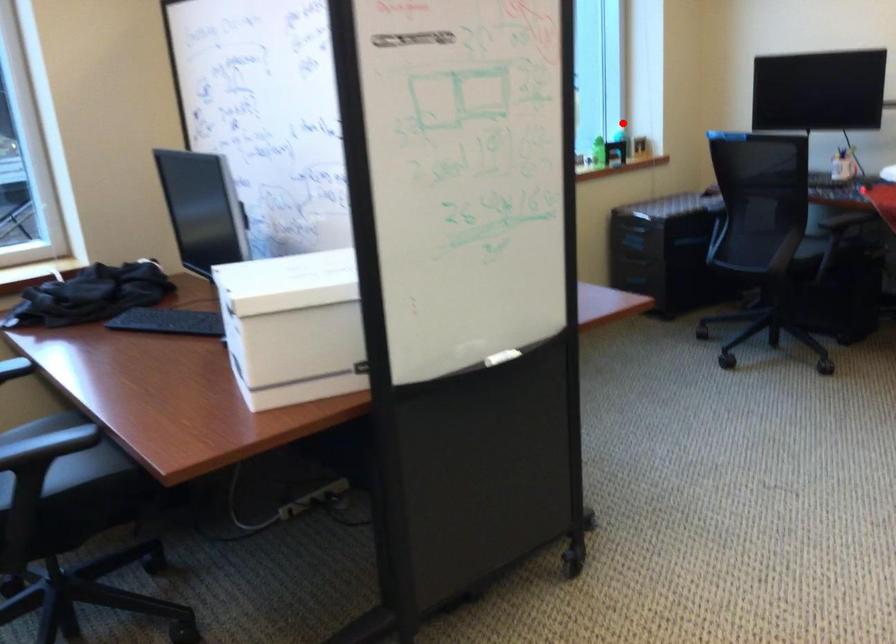
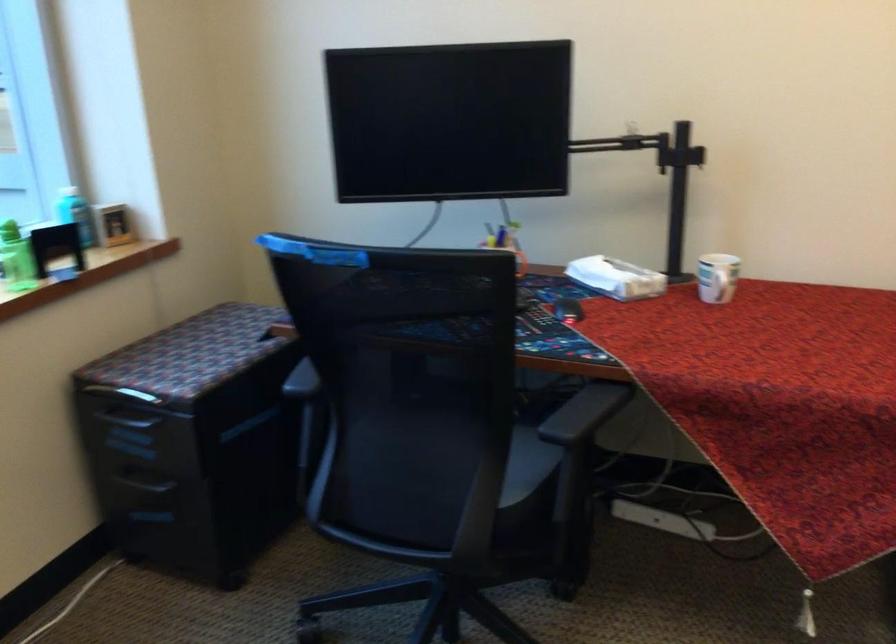
Question: A red point is marked in image1. In image2, is the corresponding 3D point closer to the camera or farther? Reply with the corresponding letter.

Choices:
 (A) The corresponding 3D point is closer.
 (B) The corresponding 3D point is farther.

Answer: (A)